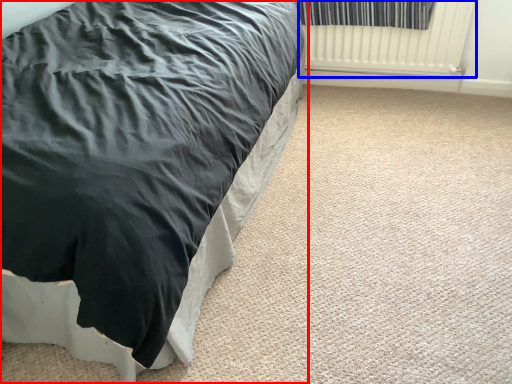
Question: Which object appears closest to the camera in this image, bed (highlighted by a red box) or radiator (highlighted by a blue box)?

Choices:
 (A) bed
 (B) radiator

Answer: (A)